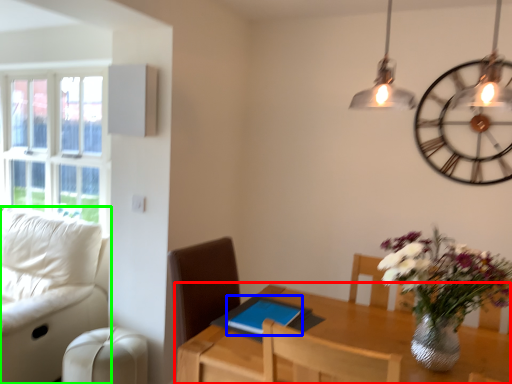
Question: Which object is the farthest from table (highlighted by a red box)? Choose among these: tablet computer (highlighted by a blue box) or studio couch (highlighted by a green box).

Choices:
 (A) tablet computer
 (B) studio couch

Answer: (B)